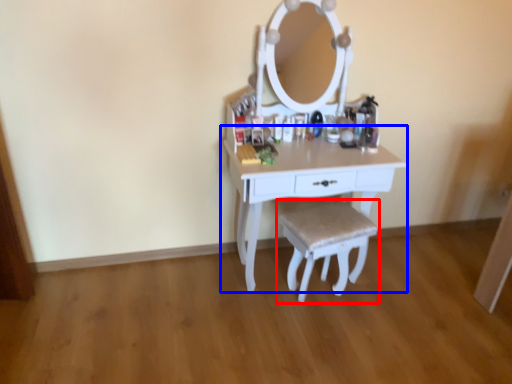
Question: Which object appears farthest to the camera in this image, step stool (highlighted by a red box) or table (highlighted by a blue box)?

Choices:
 (A) step stool
 (B) table

Answer: (A)